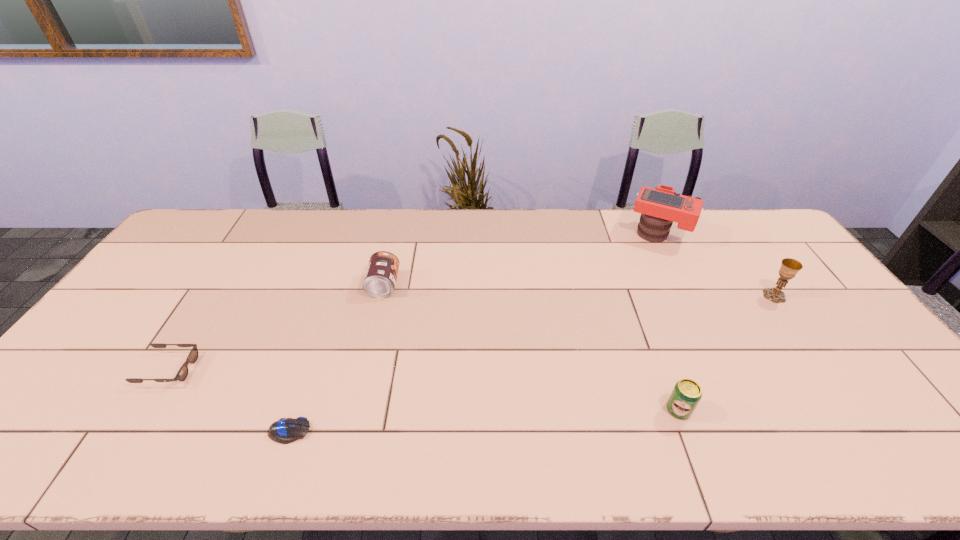
In the image, there is a desktop. Where is `vacant space at the near edge`? This screenshot has height=540, width=960. vacant space at the near edge is located at coordinates (696, 454).

Locate an element on the screen. free space at the left edge is located at coordinates (167, 274).

The width and height of the screenshot is (960, 540). I want to click on free location at the right edge, so click(907, 400).

In order to click on free space between the shortest object and the rightmost object in this screenshot , I will do `click(532, 363)`.

At what (x,y) coordinates should I click in order to perform the action: click on vacant area that lies between the beer can and the fifth object from left to right. Please return your answer as a coordinate pair (x, y). This screenshot has width=960, height=540. Looking at the image, I should click on (668, 322).

Identify the location of free area in between the beer can and the fourth farthest object. The width and height of the screenshot is (960, 540). (423, 389).

The height and width of the screenshot is (540, 960). Find the location of `vacant area that lies between the beer can and the shortest object`. vacant area that lies between the beer can and the shortest object is located at coordinates (484, 420).

The height and width of the screenshot is (540, 960). I want to click on free space between the chalice and the can, so click(579, 291).

The image size is (960, 540). In order to click on blank region between the tallest object and the third object from left to right in this screenshot , I will do `click(521, 260)`.

Identify the location of vacant area between the rightmost object and the can. This screenshot has height=540, width=960. (579, 291).